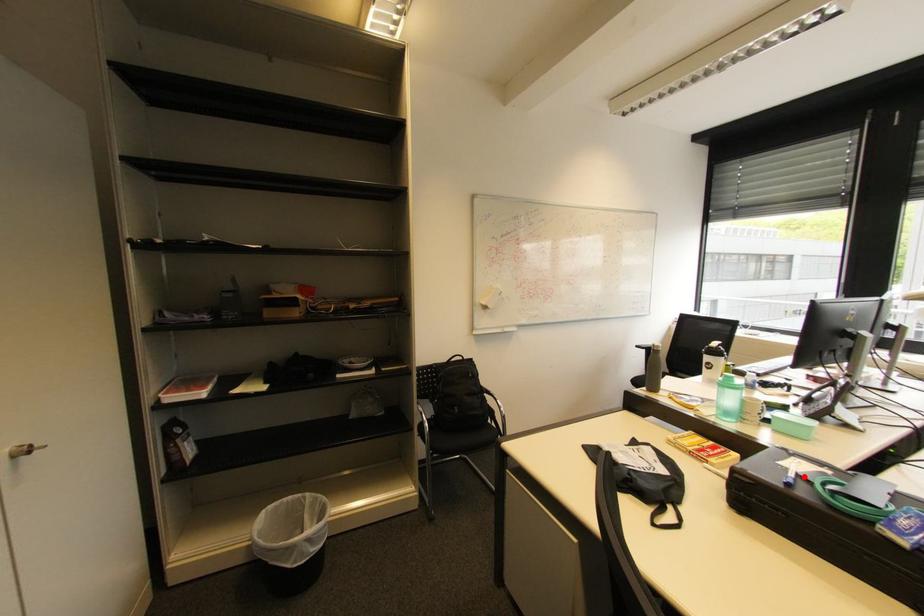
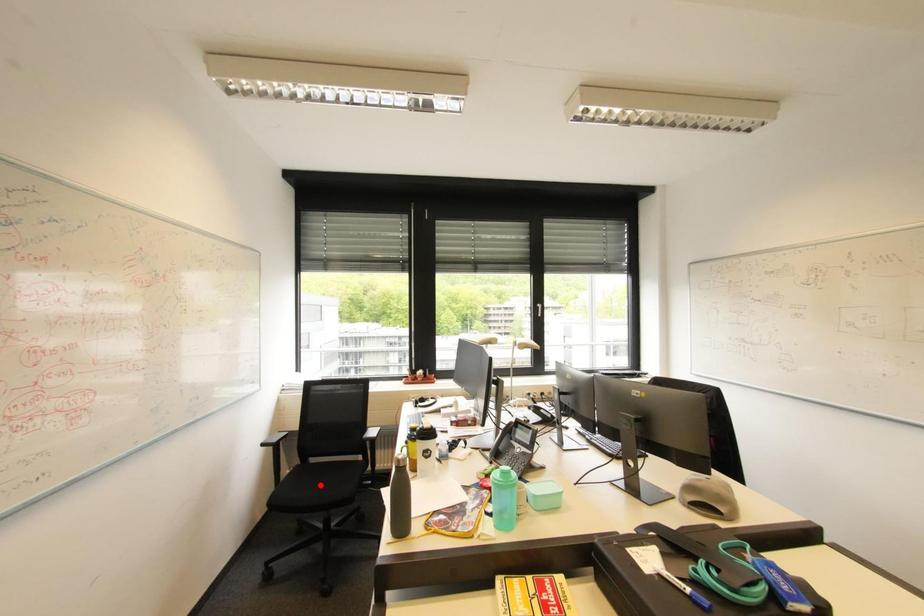
I am providing you with two images of the same scene from different viewpoints. A red point is marked on the first image and another point is marked on the second image. Is the red point in image1 aligned with the point shown in image2?

No